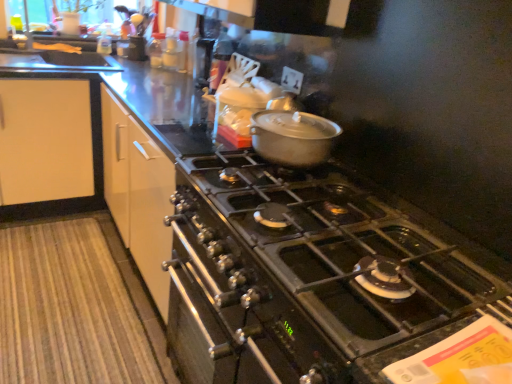
Question: From a real-world perspective, is black stainless steel oven at center positioned above or below yellow matte bread at upper left?

Choices:
 (A) below
 (B) above

Answer: (A)

Question: Is black stainless steel oven at center taller or shorter than yellow matte bread at upper left?

Choices:
 (A) tall
 (B) short

Answer: (A)

Question: Which object is the closest to the matte silver pot at center?

Choices:
 (A) yellow matte bread at upper left
 (B) black stainless steel oven at center
 (C) black matte gas stove at center

Answer: (C)

Question: Which object is the farthest from the black matte gas stove at center?

Choices:
 (A) yellow matte bread at upper left
 (B) matte silver pot at center
 (C) black stainless steel oven at center

Answer: (A)